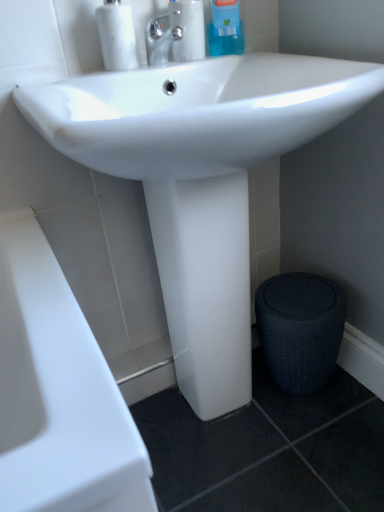
Question: Can you confirm if textured dark gray stool at lower right is shorter than blue glossy bottle at upper center, which is the 2th cleaning product from left to right?

Choices:
 (A) yes
 (B) no

Answer: (B)

Question: Is blue glossy bottle at upper center, which is counted as the first cleaning product, starting from the right, located within textured dark gray stool at lower right?

Choices:
 (A) no
 (B) yes

Answer: (A)

Question: Is textured dark gray stool at lower right looking in the opposite direction of blue glossy bottle at upper center, which is counted as the first cleaning product, starting from the right?

Choices:
 (A) no
 (B) yes

Answer: (A)

Question: Considering the relative positions of textured dark gray stool at lower right and blue glossy bottle at upper center, which is the 2th cleaning product from left to right, in the image provided, is textured dark gray stool at lower right to the left of blue glossy bottle at upper center, which is the 2th cleaning product from left to right, from the viewer's perspective?

Choices:
 (A) no
 (B) yes

Answer: (A)

Question: Is textured dark gray stool at lower right thinner than blue glossy bottle at upper center, which is the 2th cleaning product from left to right?

Choices:
 (A) no
 (B) yes

Answer: (A)

Question: Considering the relative sizes of textured dark gray stool at lower right and blue glossy bottle at upper center, which is counted as the first cleaning product, starting from the right, in the image provided, is textured dark gray stool at lower right taller than blue glossy bottle at upper center, which is counted as the first cleaning product, starting from the right,?

Choices:
 (A) no
 (B) yes

Answer: (B)

Question: From a real-world perspective, is white marble soap dispenser at upper left below blue glossy bottle at upper center, which is counted as the first cleaning product, starting from the right?

Choices:
 (A) yes
 (B) no

Answer: (A)

Question: Is white marble soap dispenser at upper left wider than blue glossy bottle at upper center, which is counted as the first cleaning product, starting from the right?

Choices:
 (A) yes
 (B) no

Answer: (A)

Question: Is white marble soap dispenser at upper left positioned in front of blue glossy bottle at upper center, which is counted as the first cleaning product, starting from the right?

Choices:
 (A) yes
 (B) no

Answer: (A)

Question: Is white marble soap dispenser at upper left turned away from blue glossy bottle at upper center, which is counted as the first cleaning product, starting from the right?

Choices:
 (A) no
 (B) yes

Answer: (A)

Question: Considering the relative sizes of white marble soap dispenser at upper left and blue glossy bottle at upper center, which is the 2th cleaning product from left to right, in the image provided, is white marble soap dispenser at upper left shorter than blue glossy bottle at upper center, which is the 2th cleaning product from left to right,?

Choices:
 (A) yes
 (B) no

Answer: (A)

Question: From the image's perspective, is white marble soap dispenser at upper left located above blue glossy bottle at upper center, which is counted as the first cleaning product, starting from the right?

Choices:
 (A) yes
 (B) no

Answer: (B)

Question: Can you confirm if textured dark gray stool at lower right is shorter than polished chrome faucet at upper center?

Choices:
 (A) yes
 (B) no

Answer: (B)